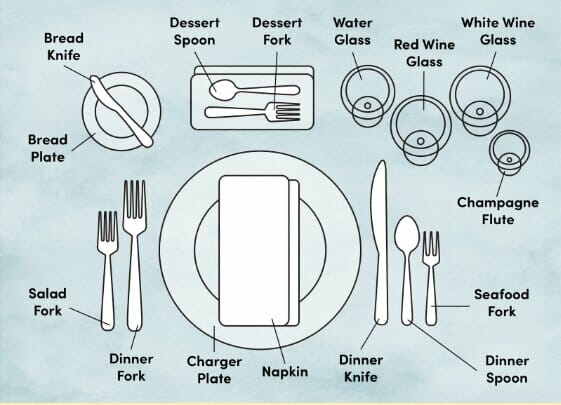
Where is `spoons`? The width and height of the screenshot is (561, 405). spoons is located at coordinates (252, 86), (404, 271).